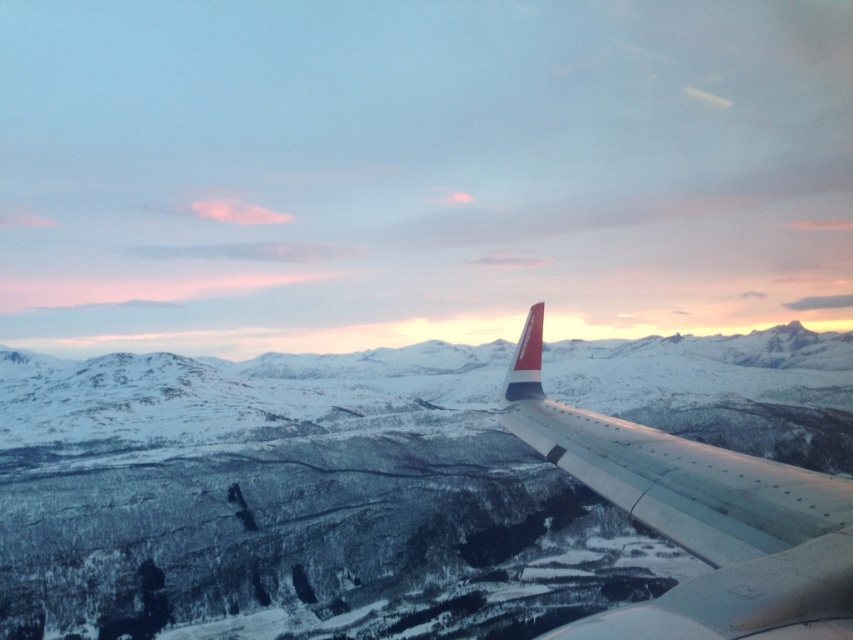
Is snowy mountain at center closer to camera compared to white metallic wing at right?

No, snowy mountain at center is behind white metallic wing at right.

Which is more to the right, snowy mountain at center or white metallic wing at right?

white metallic wing at right

Is point (431, 400) farther from viewer compared to point (793, 596)?

Yes, point (431, 400) is farther from viewer.

This screenshot has width=853, height=640. Identify the location of snowy mountain at center. (263, 481).